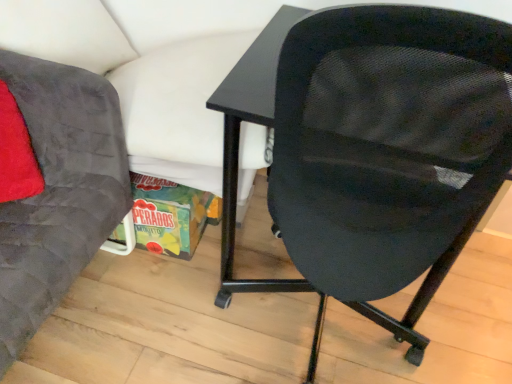
Question: Is velvet gray chair at left, which is counted as the second chair, starting from the right, oriented towards black mesh chair at center, which is counted as the 2th chair, starting from the left?

Choices:
 (A) yes
 (B) no

Answer: (B)

Question: Is the position of velvet gray chair at left, which ranks as the first chair in left-to-right order, less distant than that of black mesh chair at center, placed as the first chair when sorted from right to left?

Choices:
 (A) no
 (B) yes

Answer: (B)

Question: Is velvet gray chair at left, which is counted as the second chair, starting from the right, to the left of black mesh chair at center, placed as the first chair when sorted from right to left, from the viewer's perspective?

Choices:
 (A) no
 (B) yes

Answer: (B)

Question: Can you confirm if velvet gray chair at left, which is counted as the second chair, starting from the right, is thinner than black mesh chair at center, which is counted as the 2th chair, starting from the left?

Choices:
 (A) yes
 (B) no

Answer: (A)

Question: From the image's perspective, is velvet gray chair at left, which ranks as the first chair in left-to-right order, located above black mesh chair at center, which is counted as the 2th chair, starting from the left?

Choices:
 (A) yes
 (B) no

Answer: (B)

Question: Is velvet gray chair at left, which ranks as the first chair in left-to-right order, not within black mesh chair at center, which is counted as the 2th chair, starting from the left?

Choices:
 (A) no
 (B) yes

Answer: (B)

Question: Does black mesh chair at center, placed as the first chair when sorted from right to left, have a greater width compared to velvet gray chair at left, which ranks as the first chair in left-to-right order?

Choices:
 (A) no
 (B) yes

Answer: (B)

Question: Does black mesh chair at center, placed as the first chair when sorted from right to left, have a greater height compared to velvet gray chair at left, which is counted as the second chair, starting from the right?

Choices:
 (A) yes
 (B) no

Answer: (A)

Question: Is black mesh chair at center, which is counted as the 2th chair, starting from the left, at the right side of velvet gray chair at left, which is counted as the second chair, starting from the right?

Choices:
 (A) yes
 (B) no

Answer: (A)

Question: Does black mesh chair at center, which is counted as the 2th chair, starting from the left, have a larger size compared to velvet gray chair at left, which is counted as the second chair, starting from the right?

Choices:
 (A) yes
 (B) no

Answer: (A)

Question: Is black mesh chair at center, which is counted as the 2th chair, starting from the left, facing away from velvet gray chair at left, which is counted as the second chair, starting from the right?

Choices:
 (A) no
 (B) yes

Answer: (A)

Question: Is black mesh chair at center, placed as the first chair when sorted from right to left, smaller than velvet gray chair at left, which is counted as the second chair, starting from the right?

Choices:
 (A) yes
 (B) no

Answer: (B)

Question: From a real-world perspective, relative to black mesh chair at center, placed as the first chair when sorted from right to left, is velvet gray chair at left, which ranks as the first chair in left-to-right order, vertically above or below?

Choices:
 (A) above
 (B) below

Answer: (B)